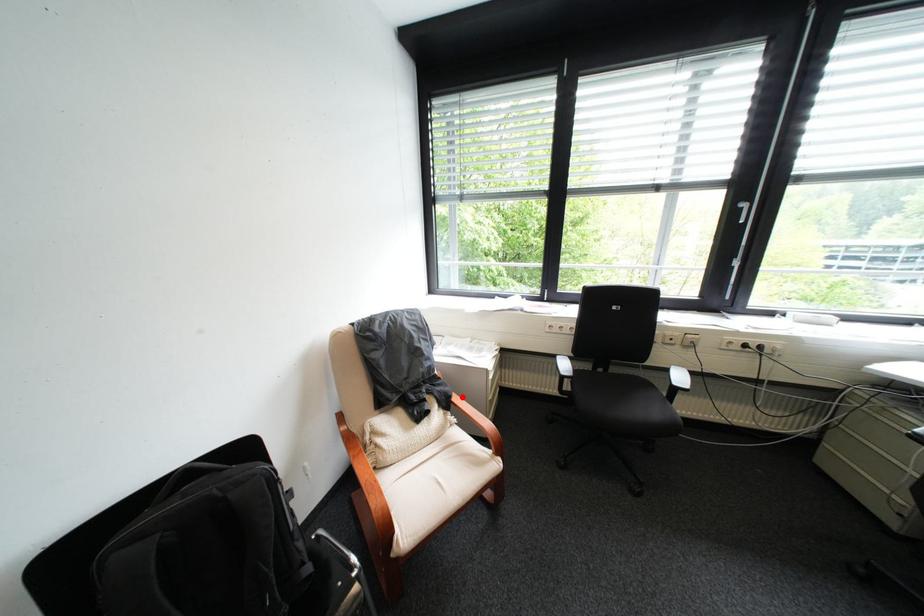
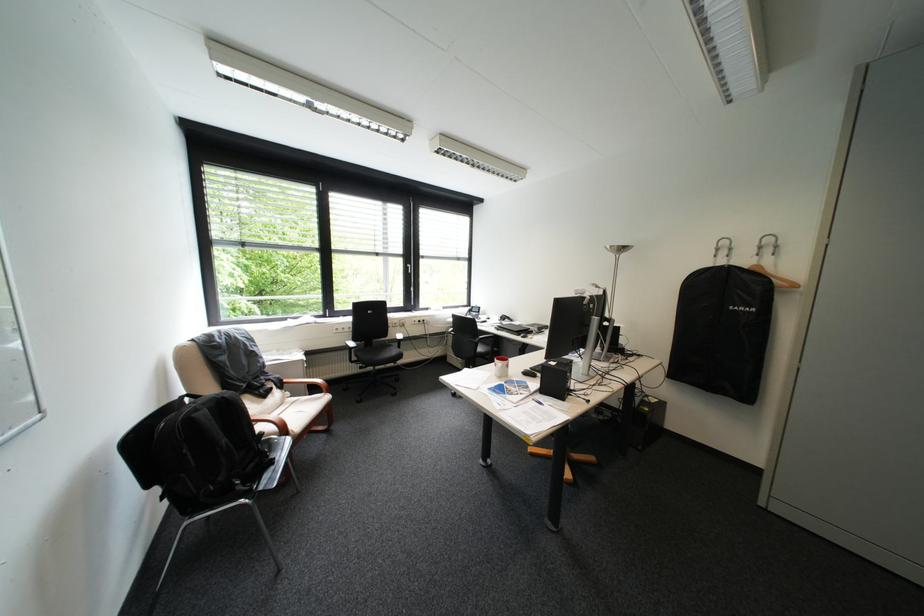
In the second image, find the point that corresponds to the highlighted location in the first image.

(294, 381)